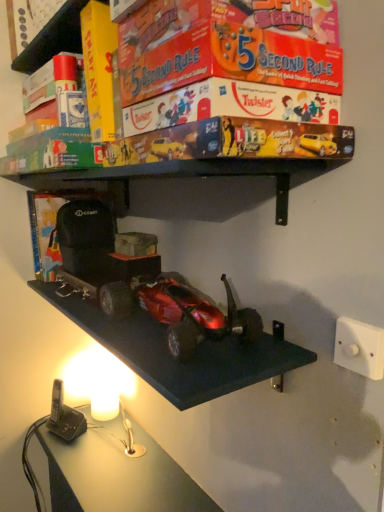
Question: Is point (175, 282) positioned closer to the camera than point (354, 320)?

Choices:
 (A) farther
 (B) closer

Answer: (A)

Question: Is shiny metallic car at center taller or shorter than white plastic/light switch at lower right?

Choices:
 (A) short
 (B) tall

Answer: (B)

Question: Which is farther from the white plastic/light switch at lower right?

Choices:
 (A) matt board game at upper center
 (B) shiny metallic car at center

Answer: (A)

Question: Which is nearer to the shiny metallic car at center?

Choices:
 (A) white plastic/light switch at lower right
 (B) matt board game at upper center

Answer: (A)